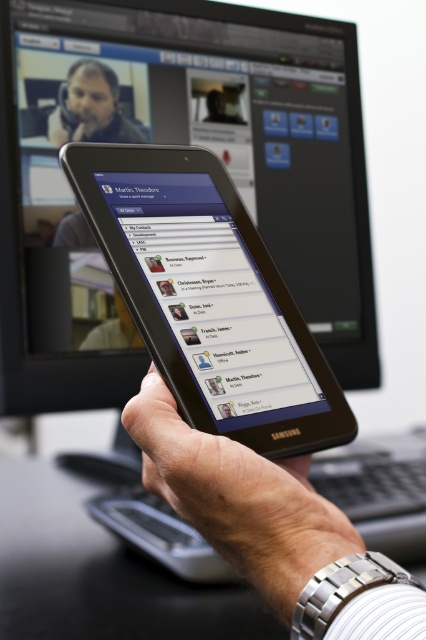
Question: Is black glossy monitor at upper center above black glossy tablet at center?

Choices:
 (A) no
 (B) yes

Answer: (B)

Question: Can you confirm if black glossy tablet at center is positioned to the left of black matte tablet at center?

Choices:
 (A) no
 (B) yes

Answer: (B)

Question: Among these points, which one is farthest from the camera?

Choices:
 (A) (196, 81)
 (B) (111, 220)

Answer: (A)

Question: Which is farther from the black glossy tablet at center?

Choices:
 (A) black glossy monitor at upper center
 (B) black matte tablet at center

Answer: (A)

Question: Estimate the real-world distances between objects in this image. Which object is farther from the black matte tablet at center?

Choices:
 (A) black glossy monitor at upper center
 (B) black glossy tablet at center

Answer: (A)

Question: Does black glossy tablet at center appear on the left side of black matte tablet at center?

Choices:
 (A) no
 (B) yes

Answer: (B)